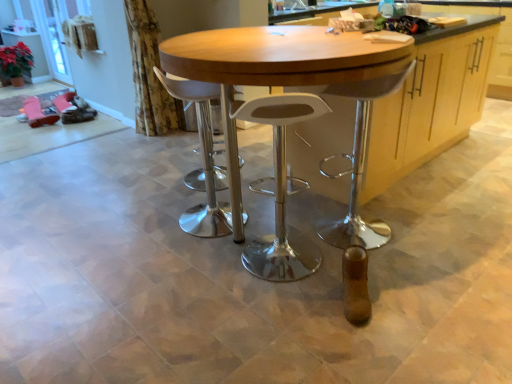
The height and width of the screenshot is (384, 512). I want to click on vacant space in between white plastic stool at center, marked as the 1th stool in a left-to-right arrangement, and white plastic stool at center, the second stool from the left, so click(239, 240).